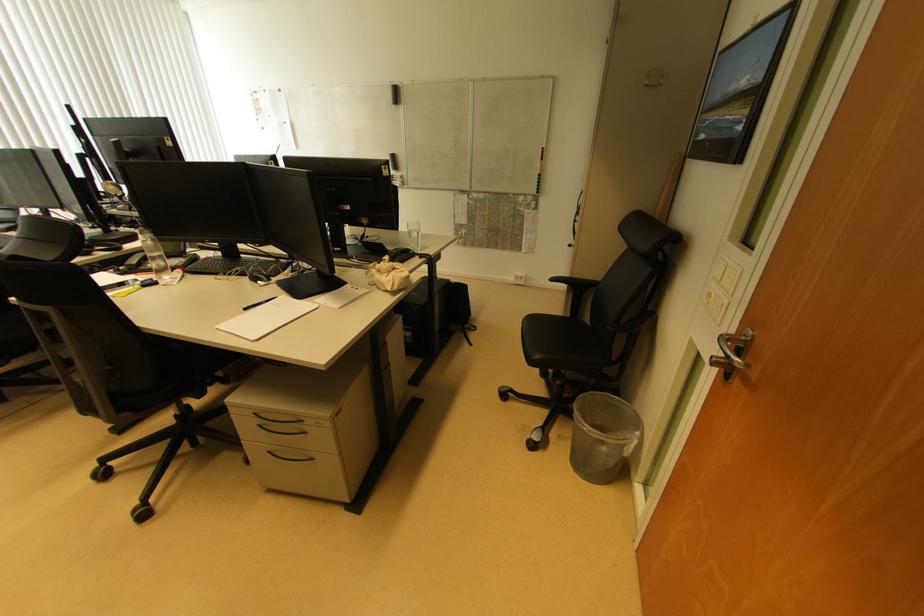
At what (x,y) coordinates should I click in order to perform the action: click on clear trash can. Please return your answer as a coordinate pair (x, y). Looking at the image, I should click on (602, 436).